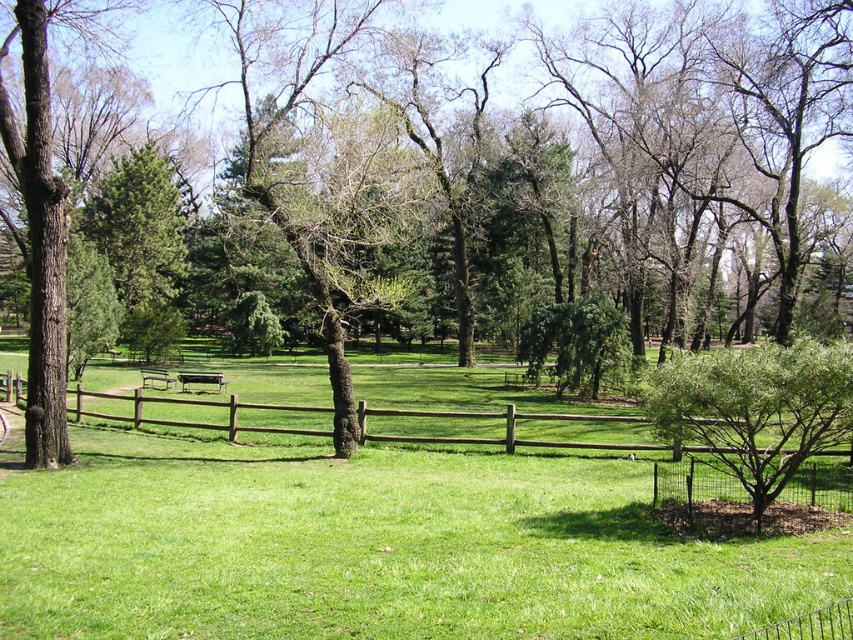
Question: Does brown wood tree at center appear on the left side of brown wooden fence at center?

Choices:
 (A) yes
 (B) no

Answer: (A)

Question: Can you confirm if brown wooden fence at center is thinner than green leafy bush at lower right?

Choices:
 (A) no
 (B) yes

Answer: (A)

Question: Does brown wooden fence at center lie in front of green leafy bush at lower right?

Choices:
 (A) yes
 (B) no

Answer: (A)

Question: Which point appears farthest from the camera in this image?

Choices:
 (A) (785, 349)
 (B) (486, 188)
 (C) (432, 488)

Answer: (B)

Question: Among these points, which one is farthest from the camera?

Choices:
 (A) (669, 500)
 (B) (10, 179)
 (C) (703, 365)

Answer: (B)

Question: Which of the following is the closest to the observer?

Choices:
 (A) click(663, 374)
 (B) click(490, 394)
 (C) click(457, 84)

Answer: (A)